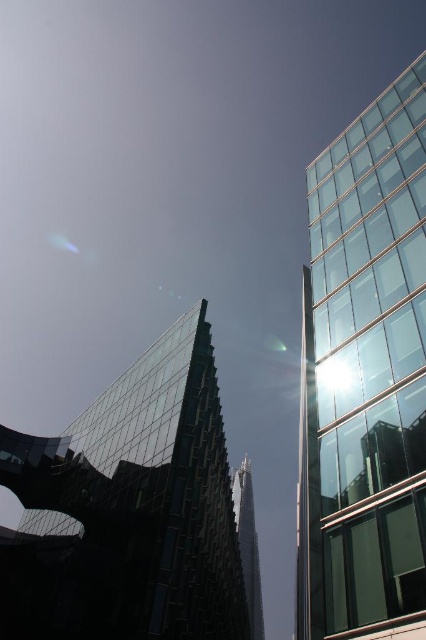
Is transparent glass tower at right wider than glassy steel tower at center?

Indeed, transparent glass tower at right has a greater width compared to glassy steel tower at center.

Consider the image. Can you confirm if transparent glass tower at right is thinner than glassy steel tower at center?

No.

Is point (348, 385) positioned after point (250, 496)?

No, (348, 385) is in front of (250, 496).

Locate an element on the screen. The height and width of the screenshot is (640, 426). transparent glass tower at right is located at coordinates (365, 378).

Who is positioned more to the left, transparent glass tower at right or transparent glass tower at center?

From the viewer's perspective, transparent glass tower at center appears more on the left side.

Where is `transparent glass tower at right`? transparent glass tower at right is located at coordinates (365, 378).

Locate an element on the screen. This screenshot has height=640, width=426. transparent glass tower at right is located at coordinates (365, 378).

Is transparent glass tower at center closer to camera compared to glassy steel tower at center?

That is True.

Can you confirm if transparent glass tower at center is positioned above glassy steel tower at center?

Yes, transparent glass tower at center is above glassy steel tower at center.

Between point (126, 602) and point (250, 586), which one is positioned behind?

Positioned behind is point (250, 586).

Image resolution: width=426 pixels, height=640 pixels. What are the coordinates of `transparent glass tower at center` in the screenshot? It's located at (129, 509).